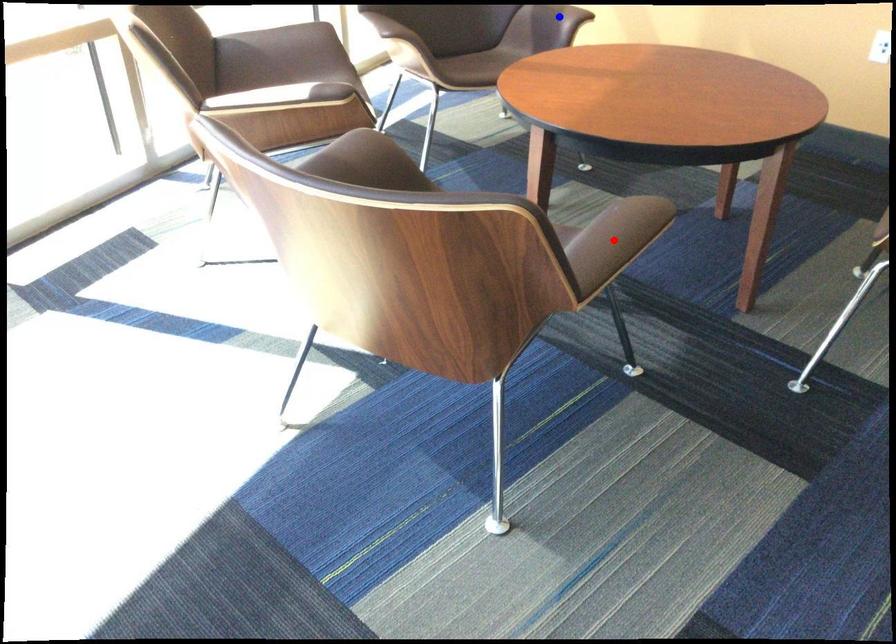
Question: Which of the two points in the image is closer to the camera?

Choices:
 (A) Blue point is closer.
 (B) Red point is closer.

Answer: (B)